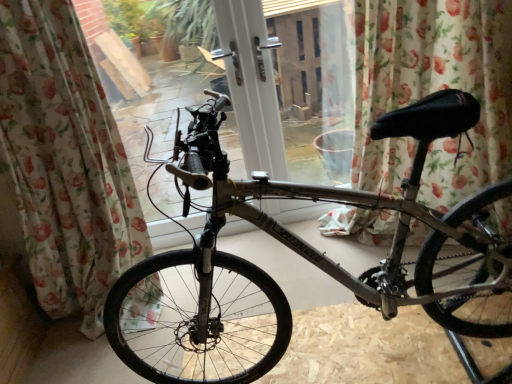
Question: Is floral fabric curtain at left, acting as the 2th curtain starting from the right, taller than floral fabric curtain at center, arranged as the second curtain when viewed from the left?

Choices:
 (A) yes
 (B) no

Answer: (A)

Question: Is floral fabric curtain at left, acting as the 2th curtain starting from the right, wider than floral fabric curtain at center, positioned as the first curtain in right-to-left order?

Choices:
 (A) yes
 (B) no

Answer: (A)

Question: From a real-world perspective, is floral fabric curtain at left, acting as the 2th curtain starting from the right, located beneath floral fabric curtain at center, arranged as the second curtain when viewed from the left?

Choices:
 (A) yes
 (B) no

Answer: (B)

Question: Does floral fabric curtain at left, positioned as the 1th curtain in left-to-right order, appear on the right side of floral fabric curtain at center, positioned as the first curtain in right-to-left order?

Choices:
 (A) no
 (B) yes

Answer: (A)

Question: Is floral fabric curtain at left, acting as the 2th curtain starting from the right, looking in the opposite direction of floral fabric curtain at center, arranged as the second curtain when viewed from the left?

Choices:
 (A) yes
 (B) no

Answer: (B)

Question: Would you say floral fabric curtain at center, arranged as the second curtain when viewed from the left, is inside or outside silver metallic bicycle at center?

Choices:
 (A) outside
 (B) inside

Answer: (A)

Question: Considering their positions, is floral fabric curtain at center, positioned as the first curtain in right-to-left order, located in front of or behind silver metallic bicycle at center?

Choices:
 (A) behind
 (B) front

Answer: (A)

Question: Considering the positions of floral fabric curtain at center, arranged as the second curtain when viewed from the left, and silver metallic bicycle at center in the image, is floral fabric curtain at center, arranged as the second curtain when viewed from the left, bigger or smaller than silver metallic bicycle at center?

Choices:
 (A) big
 (B) small

Answer: (B)

Question: Would you say floral fabric curtain at center, arranged as the second curtain when viewed from the left, is to the left or to the right of silver metallic bicycle at center in the picture?

Choices:
 (A) left
 (B) right

Answer: (B)

Question: Is floral fabric curtain at left, acting as the 2th curtain starting from the right, in front of or behind floral fabric curtain at center, arranged as the second curtain when viewed from the left, in the image?

Choices:
 (A) behind
 (B) front

Answer: (B)

Question: From the image's perspective, is floral fabric curtain at left, acting as the 2th curtain starting from the right, above or below floral fabric curtain at center, positioned as the first curtain in right-to-left order?

Choices:
 (A) below
 (B) above

Answer: (A)

Question: Looking at their shapes, would you say floral fabric curtain at left, positioned as the 1th curtain in left-to-right order, is wider or thinner than floral fabric curtain at center, positioned as the first curtain in right-to-left order?

Choices:
 (A) thin
 (B) wide

Answer: (B)

Question: From their relative heights in the image, would you say floral fabric curtain at left, positioned as the 1th curtain in left-to-right order, is taller or shorter than floral fabric curtain at center, positioned as the first curtain in right-to-left order?

Choices:
 (A) tall
 (B) short

Answer: (A)

Question: From a real-world perspective, is silver metallic bicycle at center above or below floral fabric curtain at center, positioned as the first curtain in right-to-left order?

Choices:
 (A) below
 (B) above

Answer: (A)

Question: Which is correct: silver metallic bicycle at center is inside floral fabric curtain at center, arranged as the second curtain when viewed from the left, or outside of it?

Choices:
 (A) inside
 (B) outside

Answer: (B)